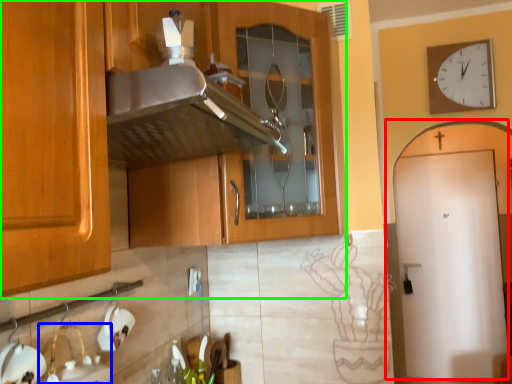
Question: Which object is the closest to the door (highlighted by a red box)? Choose among these: sink (highlighted by a blue box) or cabinetry (highlighted by a green box).

Choices:
 (A) sink
 (B) cabinetry

Answer: (B)